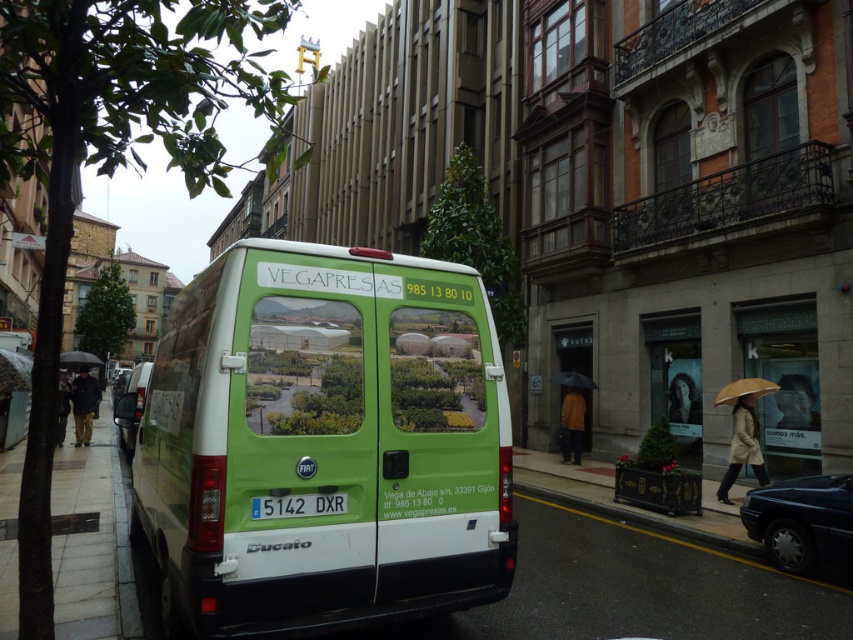
You are a delivery driver approaching the smooth concrete curb at lower center in the scene. You need to park your van as close as possible to the curb without crossing a line that is 10 meters away from the curb. Can you safely park within this limit?

The distance between the smooth concrete curb at lower center and the camera is 9.65 meters, which is under the 10 meter limit. Therefore, you can safely park your van within the allowed distance.